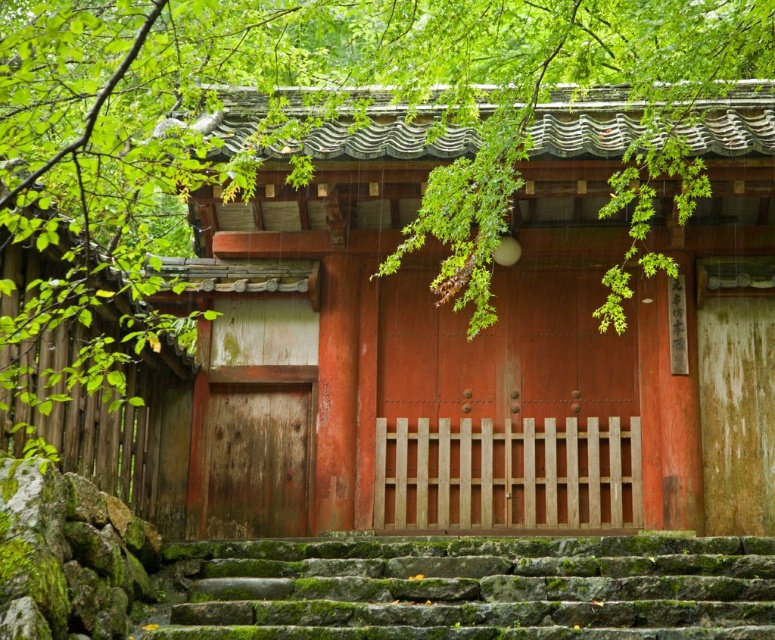
Question: Estimate the real-world distances between objects in this image. Which object is closer to the wooden gate at center?

Choices:
 (A) green mossy stone stairs at lower center
 (B) green leafy branch at upper center

Answer: (B)

Question: Which of these objects is positioned closest to the wooden gate at center?

Choices:
 (A) green leafy branch at upper center
 (B) green mossy stone stairs at lower center

Answer: (A)

Question: Which point is closer to the camera?

Choices:
 (A) green leafy branch at upper center
 (B) wooden gate at center

Answer: (A)

Question: Can you confirm if green leafy branch at upper center is positioned to the left of wooden gate at center?

Choices:
 (A) no
 (B) yes

Answer: (B)

Question: Is green leafy branch at upper center bigger than green mossy stone stairs at lower center?

Choices:
 (A) no
 (B) yes

Answer: (B)

Question: Does green leafy branch at upper center have a greater width compared to wooden gate at center?

Choices:
 (A) yes
 (B) no

Answer: (A)